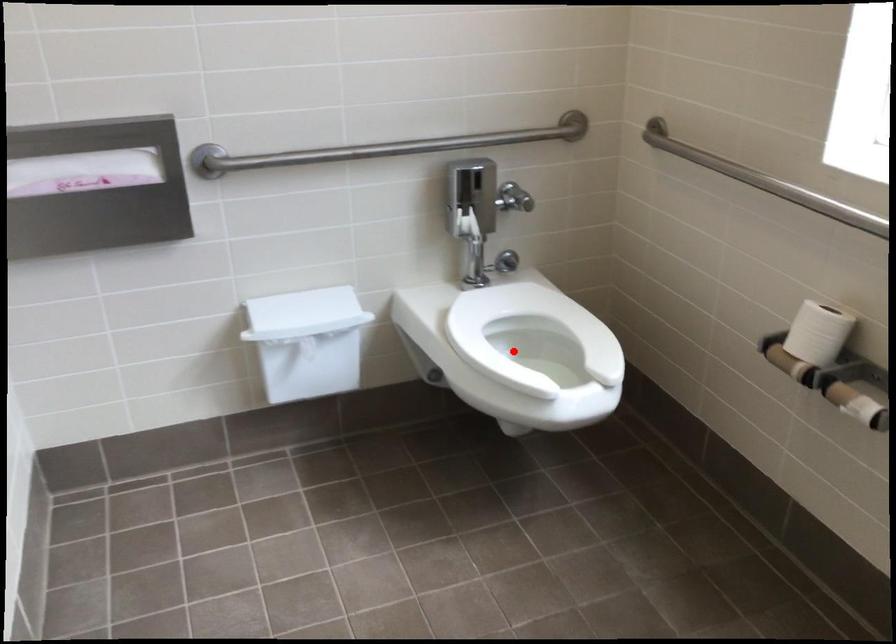
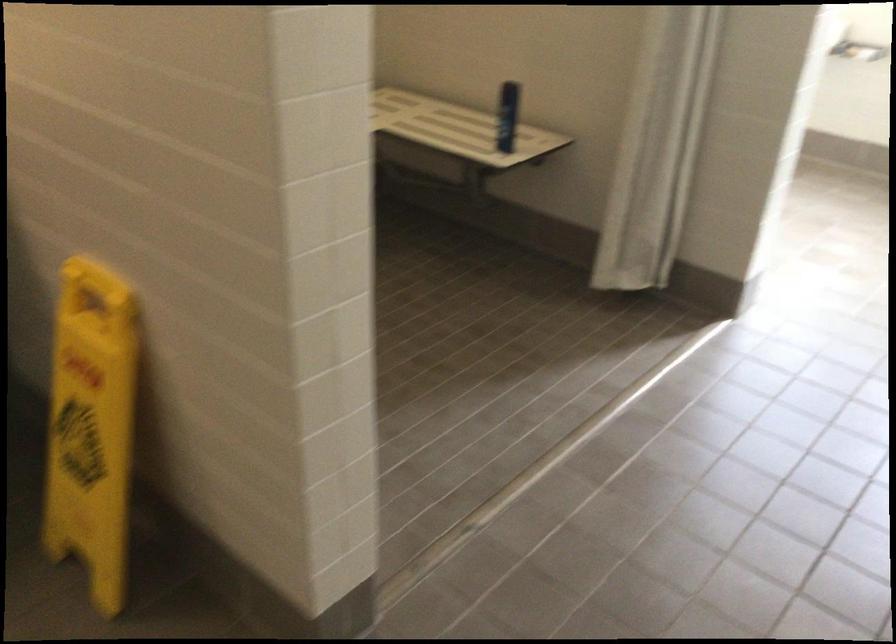
Question: I am providing you with two images of the same scene from different viewpoints. A red point is marked on the first image. At the location where the point appears in image 1, is it still visible in image 2?

Choices:
 (A) Yes
 (B) No

Answer: (B)